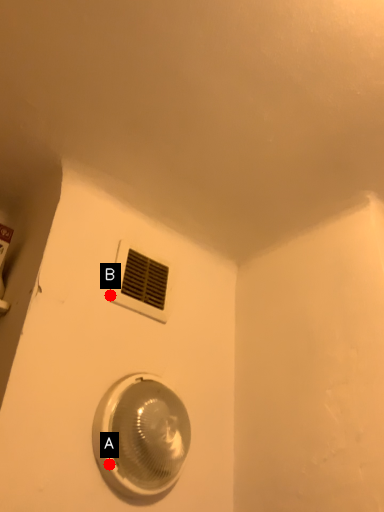
Question: Two points are circled on the image, labeled by A and B beside each circle. Which of the following is the farthest from the observer?

Choices:
 (A) A is further
 (B) B is further

Answer: (B)